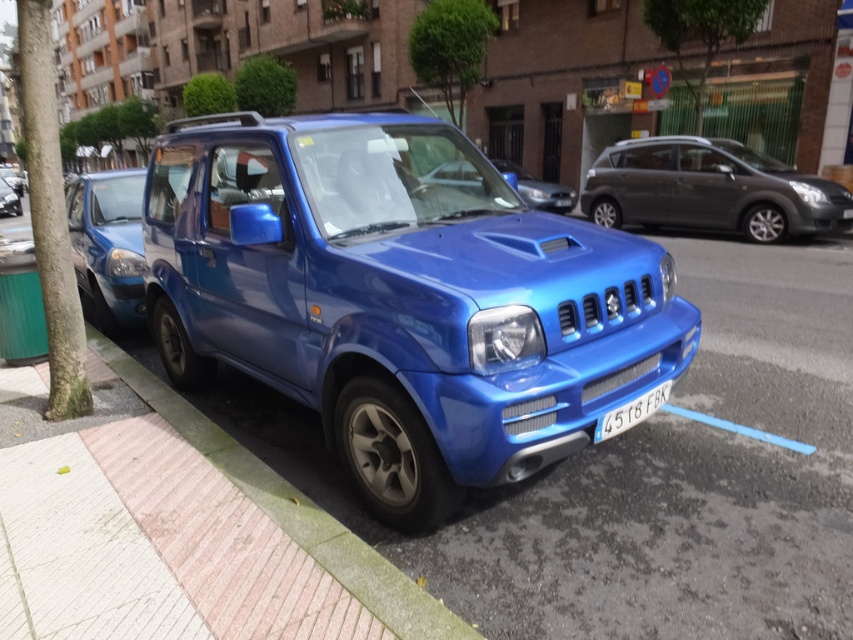
You are a delivery driver who needs to park your metallic blue car at center in a parking spot located at coordinates 0.3, 0.63. Can you safely park your car there?

The metallic blue car at center is already positioned at point [537,188], which is very close to the desired coordinates [537,192]. Therefore, it is already parked safely in the correct location.

You are standing at the point labeled as point (457,182) and want to walk to the point labeled as point (370,604). According to the scene description, which direction should you face to move towards your destination?

You should face forward because point (370,604) is in front of point (457,182).